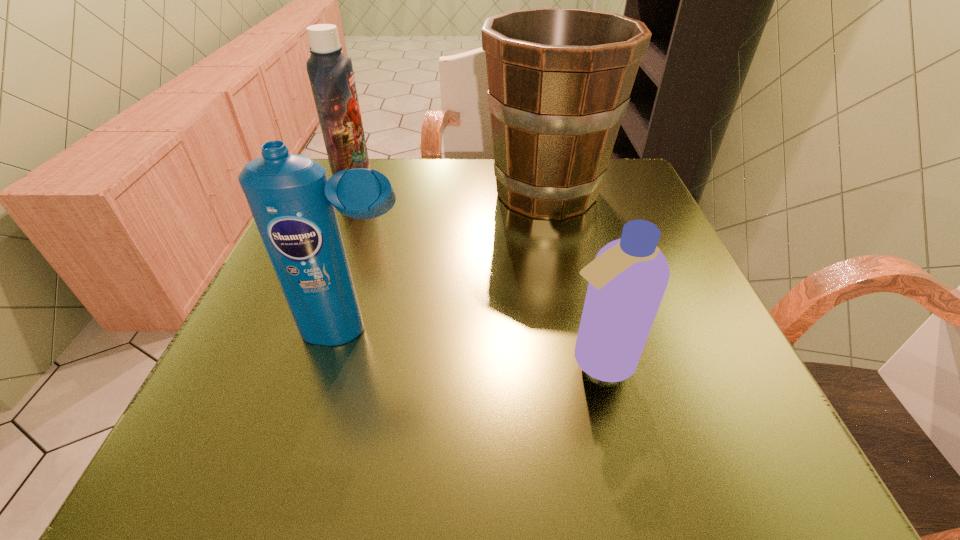
Where is `shampoo that is at the right edge`? The image size is (960, 540). shampoo that is at the right edge is located at coordinates (627, 280).

Where is `object positioned at the far left corner`? object positioned at the far left corner is located at coordinates (330, 72).

I want to click on object present at the far right corner, so click(559, 79).

Locate an element on the screen. free space at the far edge of the desktop is located at coordinates (416, 202).

In order to click on free space at the near edge in this screenshot , I will do `click(659, 462)`.

The width and height of the screenshot is (960, 540). In the image, there is a desktop. What are the coordinates of `vacant region at the left edge` in the screenshot? It's located at 260,298.

In the image, there is a desktop. Identify the location of vacant space at the right edge. (599, 238).

This screenshot has width=960, height=540. Find the location of `free space at the far right corner of the desktop`. free space at the far right corner of the desktop is located at coordinates [633, 162].

Where is `free space at the near right corner of the desktop`? free space at the near right corner of the desktop is located at coordinates (690, 427).

You are a GUI agent. You are given a task and a screenshot of the screen. Output one action in this format:
    pyautogui.click(x=<x>, y=<y>)
    Task: Click on the vacant space in between the farthest shampoo and the bucket
    
    Given the screenshot: What is the action you would take?
    pyautogui.click(x=451, y=190)